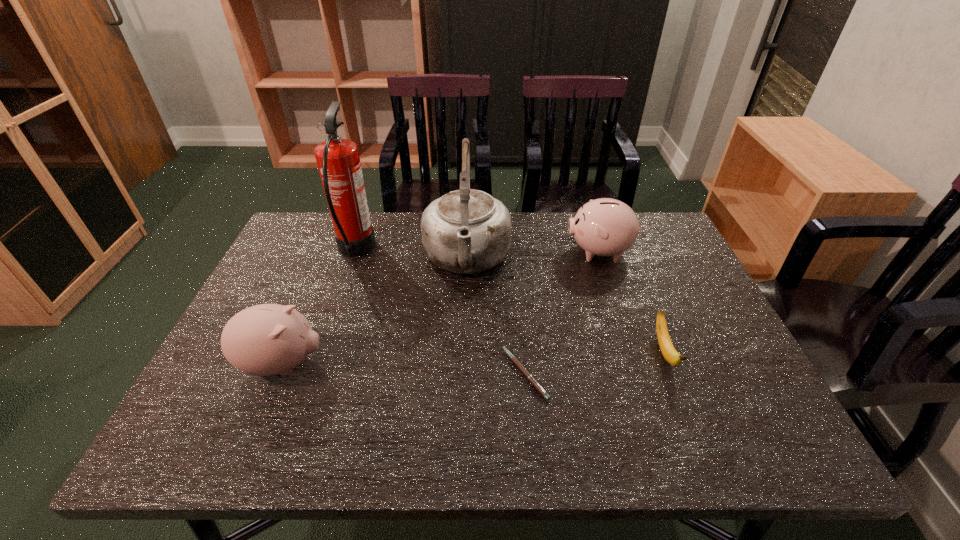
Image resolution: width=960 pixels, height=540 pixels. What are the coordinates of `free space between the shortest object and the farther piggy bank` in the screenshot? It's located at (564, 313).

Image resolution: width=960 pixels, height=540 pixels. In order to click on empty location between the shortest object and the banana in this screenshot , I will do `click(594, 363)`.

Find the location of `free area in between the left piggy bank and the banana`. free area in between the left piggy bank and the banana is located at coordinates (473, 358).

You are a GUI agent. You are given a task and a screenshot of the screen. Output one action in this format:
    pyautogui.click(x=<x>, y=<y>)
    Task: Click on the free space between the fire extinguisher and the pen
    Image resolution: width=960 pixels, height=540 pixels.
    Given the screenshot: What is the action you would take?
    pyautogui.click(x=441, y=312)

Where is `vacant point located between the right piggy bank and the left piggy bank`? This screenshot has width=960, height=540. vacant point located between the right piggy bank and the left piggy bank is located at coordinates (443, 308).

In order to click on vacant region between the fire extinguisher and the second tallest object in this screenshot , I will do `click(411, 254)`.

You are a GUI agent. You are given a task and a screenshot of the screen. Output one action in this format:
    pyautogui.click(x=<x>, y=<y>)
    Task: Click on the object that stands as the second closest to the shortest object
    Image resolution: width=960 pixels, height=540 pixels.
    Given the screenshot: What is the action you would take?
    [x=668, y=351]

This screenshot has height=540, width=960. In order to click on the third closest object to the nearer piggy bank in this screenshot , I will do `click(530, 378)`.

At what (x,y) coordinates should I click in order to perform the action: click on free space that satisfies the following two spatial constraints: 1. at the stem of the banana; 2. at the snout of the left piggy bank. Please return your answer as a coordinate pair (x, y). The height and width of the screenshot is (540, 960). Looking at the image, I should click on (668, 364).

Locate an element on the screen. This screenshot has height=540, width=960. vacant position in the image that satisfies the following two spatial constraints: 1. at the stem of the banana; 2. at the snout of the left piggy bank is located at coordinates (668, 364).